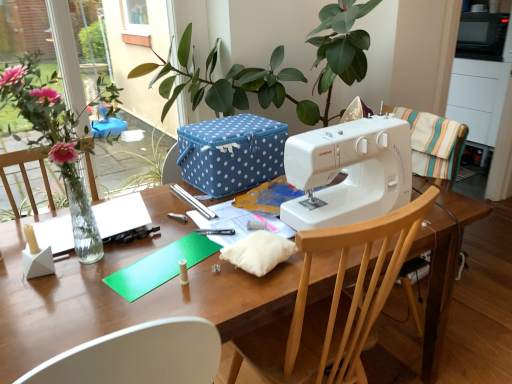
Question: Considering the positions of green leafy plant at left and wooden table at center in the image, is green leafy plant at left wider or thinner than wooden table at center?

Choices:
 (A) thin
 (B) wide

Answer: (A)

Question: Based on their positions, is green leafy plant at left located to the left or right of wooden table at center?

Choices:
 (A) right
 (B) left

Answer: (B)

Question: Which object is positioned farthest from the wooden chair at center, the first chair from the bottom?

Choices:
 (A) wooden table at center
 (B) blue polka dot fabric box at center
 (C) wooden chair at right, the 1th chair viewed from the right
 (D) white plastic sewing machine at center
 (E) green leafy plant at left

Answer: (E)

Question: Which is farther from the green leafy plant at left?

Choices:
 (A) wooden chair at right, marked as the second chair in a bottom-to-top arrangement
 (B) wooden table at center
 (C) blue polka dot fabric box at center
 (D) white plastic sewing machine at center
 (E) wooden chair at center, which appears as the second chair when viewed from the right

Answer: (A)